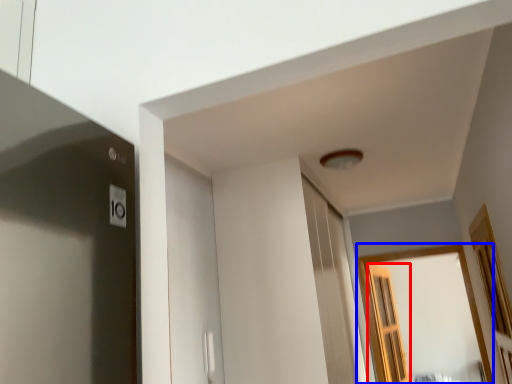
Question: Which object appears closest to the camera in this image, screen door (highlighted by a red box) or window (highlighted by a blue box)?

Choices:
 (A) screen door
 (B) window

Answer: (B)